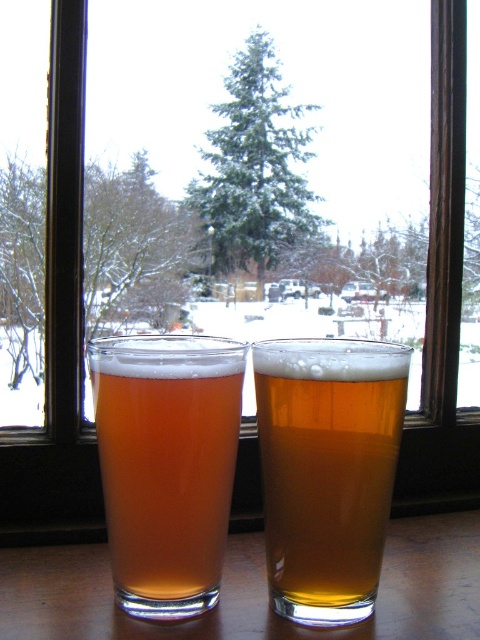
Who is higher up, translucent amber glass at center or transparent glass at center?

translucent amber glass at center is higher up.

At what (x,y) coordinates should I click in order to perform the action: click on translucent amber glass at center. Please return your answer as a coordinate pair (x, y). This screenshot has width=480, height=640. Looking at the image, I should click on (167, 465).

I want to click on translucent amber glass at center, so click(167, 465).

Is point (387, 358) farther from camera compared to point (190, 520)?

No, (387, 358) is in front of (190, 520).

Who is taller, golden glass beer at center or translucent amber glass at center?

golden glass beer at center is taller.

Does point (254, 381) lie in front of point (123, 428)?

No, it is behind (123, 428).

Locate an element on the screen. golden glass beer at center is located at coordinates (326, 470).

Which is in front, point (343, 362) or point (19, 554)?

Point (343, 362) is more forward.

Who is more distant from viewer, [310,410] or [36,584]?

Point [36,584]

This screenshot has width=480, height=640. Identify the location of golden glass beer at center. (326, 470).